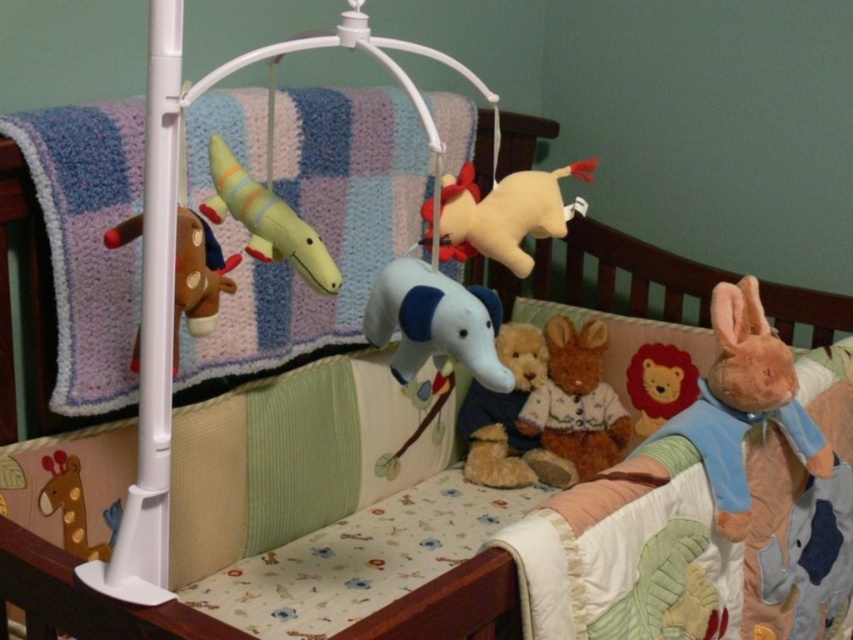
Can you confirm if knitted wool blanket at upper left is shorter than fluffy orange rabbit at right?

In fact, knitted wool blanket at upper left may be taller than fluffy orange rabbit at right.

Identify the location of knitted wool blanket at upper left. (322, 227).

Identify the location of knitted wool blanket at upper left. (322, 227).

Is brown plush rabbit at center wider than brown plush horse at left?

Yes.

Does brown plush rabbit at center have a lesser width compared to brown plush horse at left?

In fact, brown plush rabbit at center might be wider than brown plush horse at left.

Between point (569, 413) and point (202, 250), which one is positioned behind?

Point (569, 413)

The width and height of the screenshot is (853, 640). Identify the location of brown plush rabbit at center. (x=576, y=401).

Who is higher up, soft beige plush unicorn at center or matte yellow giraffe at lower left?

soft beige plush unicorn at center is higher up.

Who is positioned more to the right, soft beige plush unicorn at center or matte yellow giraffe at lower left?

soft beige plush unicorn at center

Between point (473, 237) and point (73, 464), which one is positioned behind?

The point (73, 464) is behind.

I want to click on soft beige plush unicorn at center, so click(505, 212).